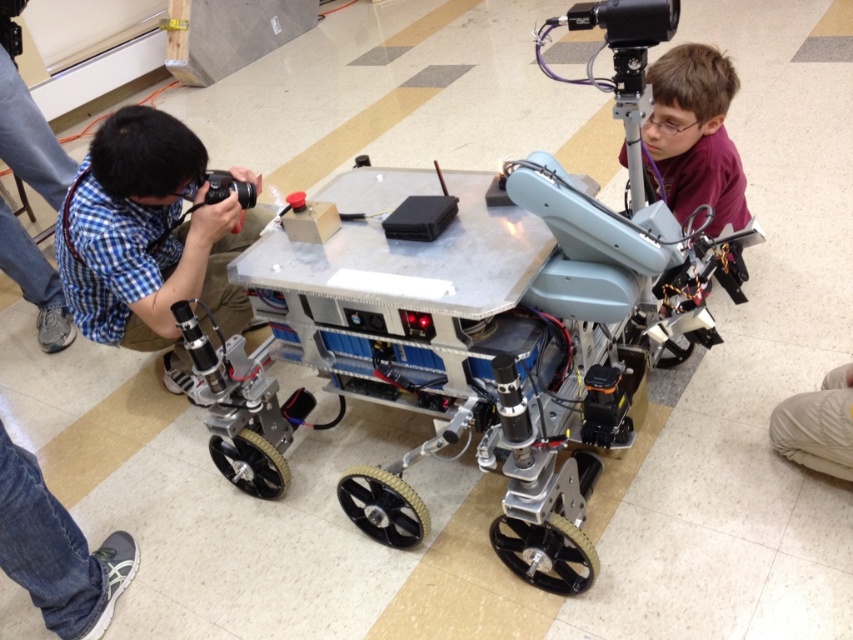
Between point (682, 196) and point (225, 172), which one is positioned in front?

Point (225, 172) is more forward.

Who is more distant from viewer, (723, 218) or (236, 189)?

Point (723, 218)

I want to click on maroon shirt at upper right, so click(695, 134).

In the scene shown: Is maroon shirt at upper right shorter than white fabric pants at lower right?

In fact, maroon shirt at upper right may be taller than white fabric pants at lower right.

In the scene shown: Is maroon shirt at upper right above white fabric pants at lower right?

Yes, maroon shirt at upper right is above white fabric pants at lower right.

Is point (664, 93) closer to camera compared to point (785, 413)?

No, it is not.

Locate an element on the screen. This screenshot has height=640, width=853. maroon shirt at upper right is located at coordinates (695, 134).

Does jeans at lower left have a greater width compared to maroon shirt at upper right?

No.

Who is shorter, jeans at lower left or maroon shirt at upper right?

Standing shorter between the two is maroon shirt at upper right.

What do you see at coordinates (56, 552) in the screenshot? I see `jeans at lower left` at bounding box center [56, 552].

Locate an element on the screen. Image resolution: width=853 pixels, height=640 pixels. jeans at lower left is located at coordinates (56, 552).